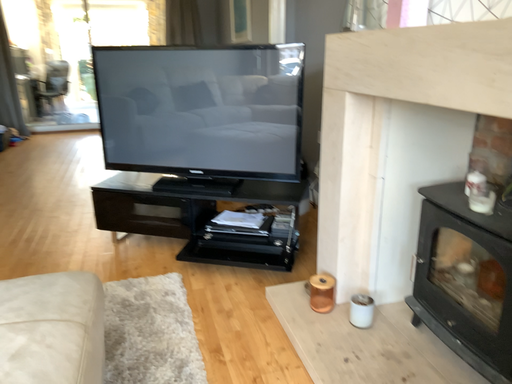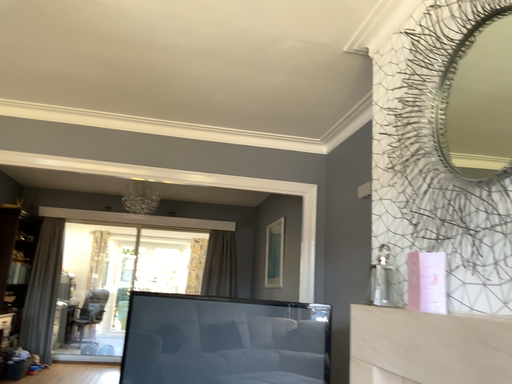
Question: Which way did the camera rotate in the video?

Choices:
 (A) rotated upward
 (B) rotated downward

Answer: (A)